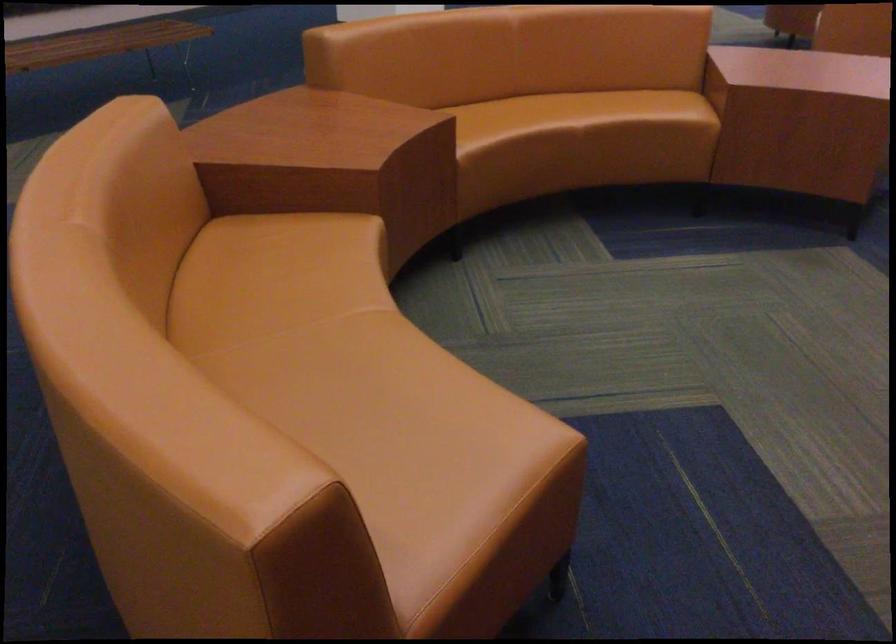
What do you see at coordinates (297, 151) in the screenshot? Image resolution: width=896 pixels, height=644 pixels. I see `a tan sofa armrest` at bounding box center [297, 151].